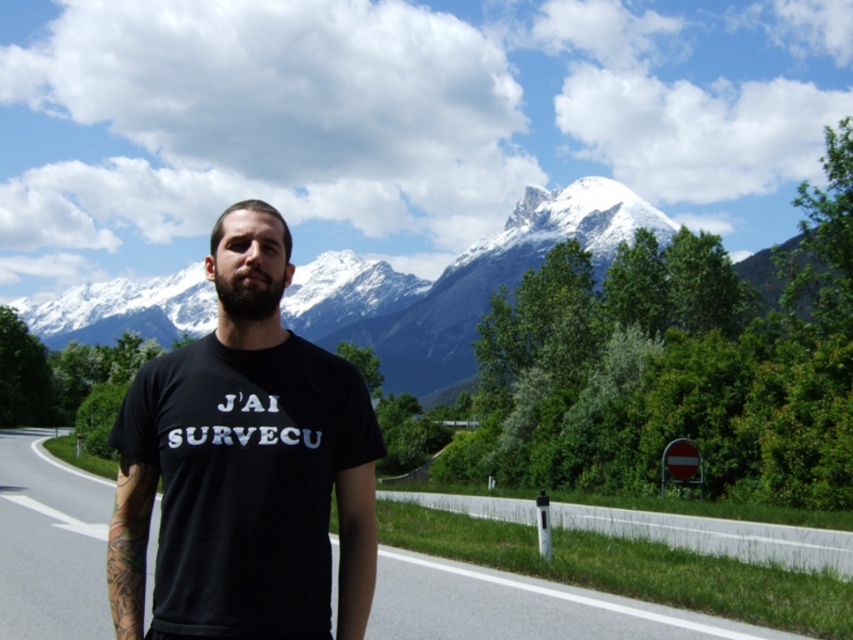
Does black asphalt road at center appear on the right side of dark brown fuzzy beard at center?

No, black asphalt road at center is not to the right of dark brown fuzzy beard at center.

Does black asphalt road at center lie in front of dark brown fuzzy beard at center?

No, black asphalt road at center is further to the viewer.

Locate an element on the screen. The image size is (853, 640). black asphalt road at center is located at coordinates (521, 608).

Where is `black cotton t-shirt at center`? black cotton t-shirt at center is located at coordinates (244, 490).

Is black cotton t-shirt at center to the right of black asphalt road at center from the viewer's perspective?

Indeed, black cotton t-shirt at center is positioned on the right side of black asphalt road at center.

Does point (280, 349) come in front of point (78, 573)?

Yes, it is.

Where is `black cotton t-shirt at center`? This screenshot has width=853, height=640. black cotton t-shirt at center is located at coordinates (244, 490).

Is point (315, 496) in front of point (254, 262)?

That is True.

Which is in front, point (234, 502) or point (264, 300)?

Point (234, 502) is more forward.

Which is in front, point (343, 579) or point (263, 273)?

Point (343, 579)

This screenshot has height=640, width=853. In order to click on black cotton t-shirt at center in this screenshot , I will do `click(244, 490)`.